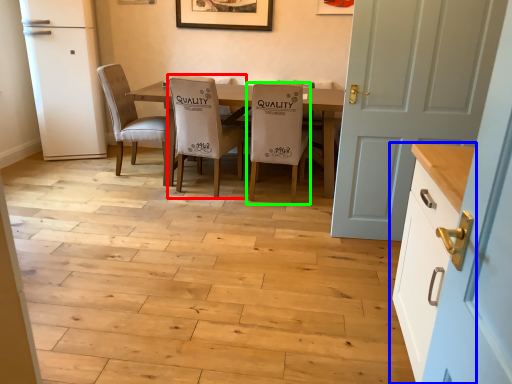
Question: Considering the real-world distances, which object is farthest from chair (highlighted by a red box)? cabinetry (highlighted by a blue box) or chair (highlighted by a green box)?

Choices:
 (A) cabinetry
 (B) chair

Answer: (A)